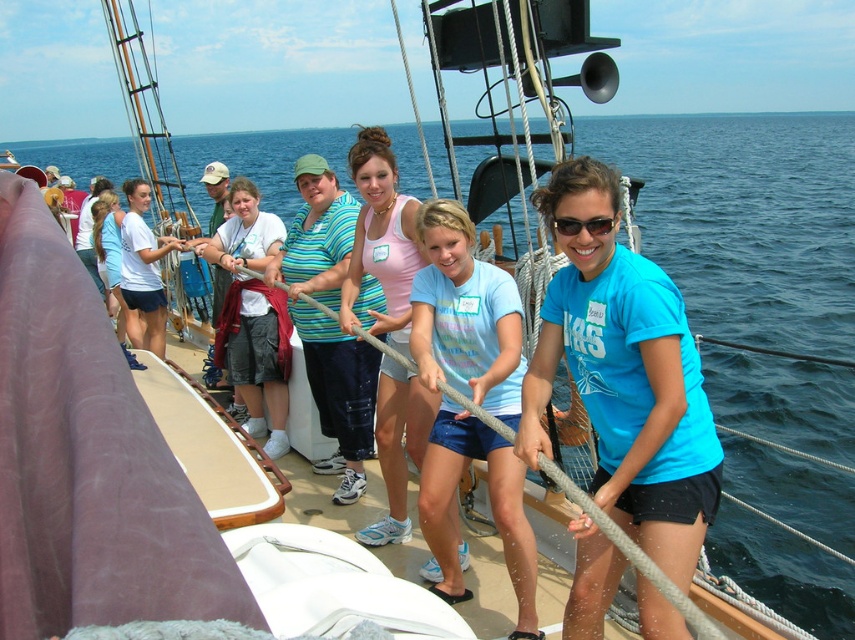
Does blue cotton shirt at center have a greater height compared to striped cotton shirt at center?

No.

Is point (677, 392) in front of point (363, 380)?

Yes.

Who is more forward, (664,452) or (293,262)?

Point (664,452)

You are a GUI agent. You are given a task and a screenshot of the screen. Output one action in this format:
    pyautogui.click(x=<x>, y=<y>)
    Task: Click on the blue cotton shirt at center
    This screenshot has height=640, width=855.
    Given the screenshot: What is the action you would take?
    pyautogui.click(x=624, y=374)

Locate an element on the screen. Image resolution: width=855 pixels, height=640 pixels. light blue t-shirt at center is located at coordinates (464, 316).

Does point (473, 442) lie in front of point (329, 413)?

Yes, it is in front of point (329, 413).

Image resolution: width=855 pixels, height=640 pixels. What do you see at coordinates (464, 316) in the screenshot?
I see `light blue t-shirt at center` at bounding box center [464, 316].

I want to click on light blue t-shirt at center, so click(x=464, y=316).

Is light blue t-shirt at center positioned in front of matte pink tank top at center?

That is True.

Which is behind, point (520, 580) or point (381, 317)?

Point (381, 317)

Does point (417, 324) come in front of point (376, 275)?

That is True.

Find the location of a particular element. The image size is (855, 640). light blue t-shirt at center is located at coordinates (464, 316).